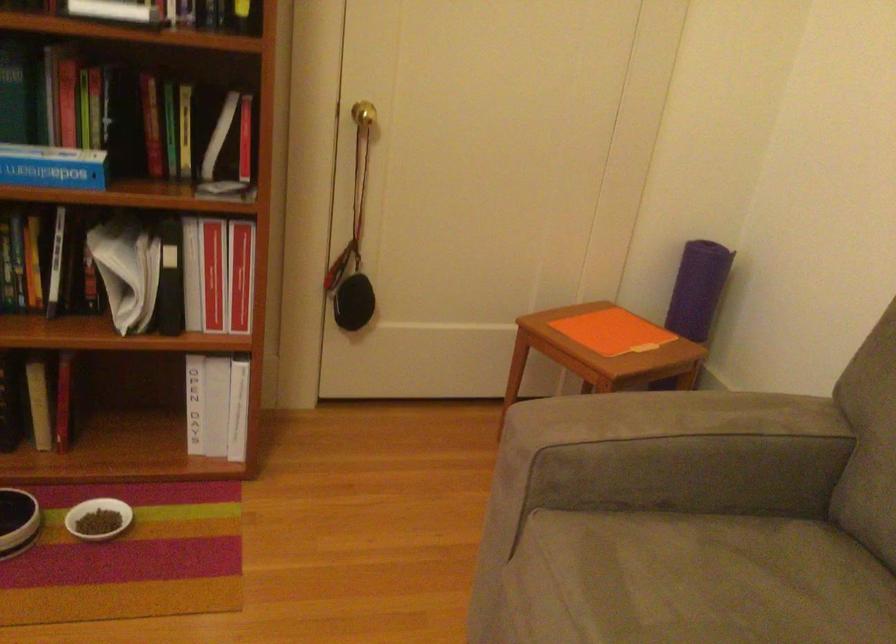
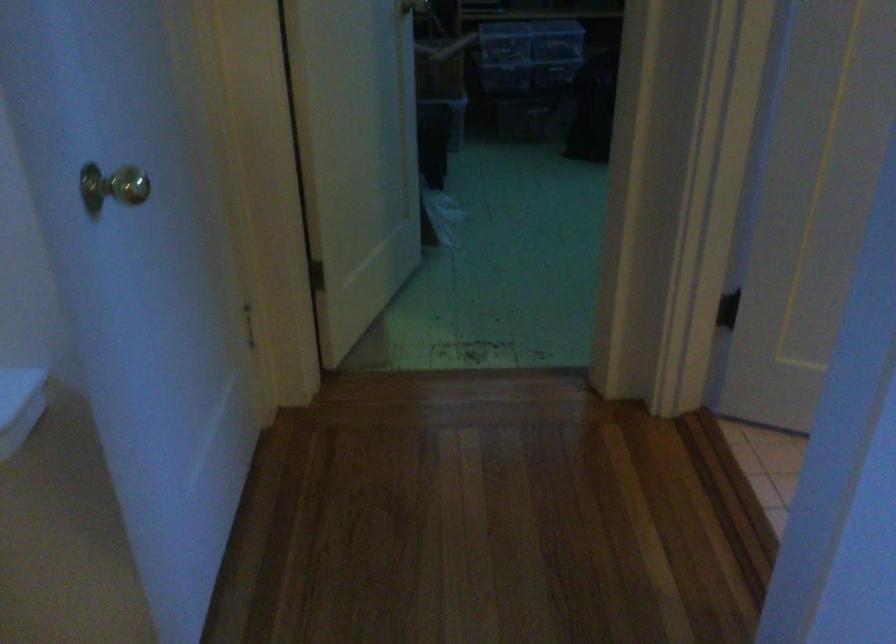
Which direction would the cameraman need to move to produce the second image?

The movement direction of the cameraman is left, forward.